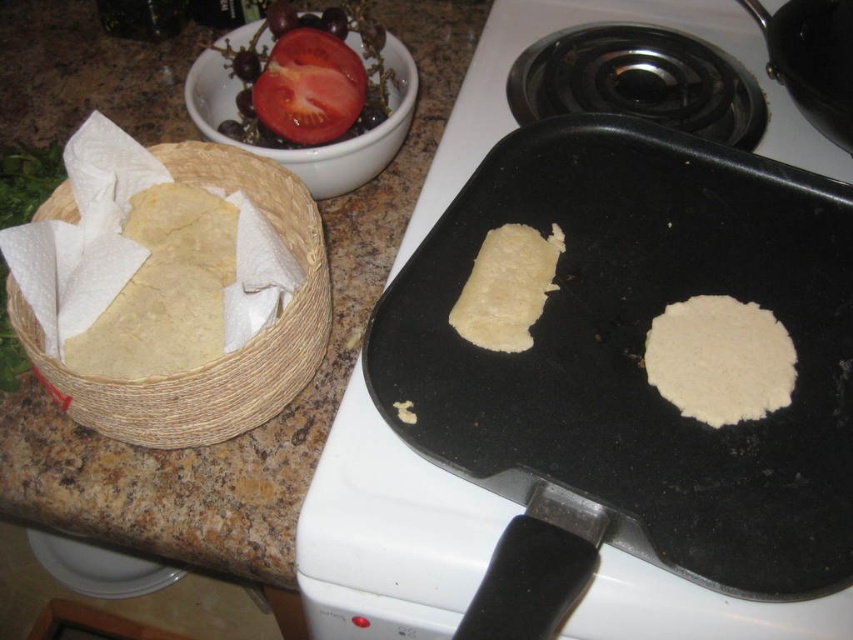
You are a chef standing 20 inches away from the matte black griddle at center. Can you reach it without moving your feet?

The matte black griddle at center is 15.87 inches away from the camera, so if you are standing 20 inches away from it, you cannot reach it without moving your feet since the distance is greater than your typical arm reach.

You are a chef preparing a meal and need to move the woven straw basket at left to access the ingredients in the woven basket lined with white paper towels. Can you slide the matte black griddle at center out of the way first?

The matte black griddle at center is in front of the woven straw basket at left, so you can slide the matte black griddle at center out of the way to access the woven basket lined with white paper towels.

You are a chef preparing ingredients for a meal. You need to place the woven straw basket at left onto the matte black griddle at center. Is this possible based on their positions?

The matte black griddle at center is below the woven straw basket at left, so the basket can be moved downward to place it onto the griddle.